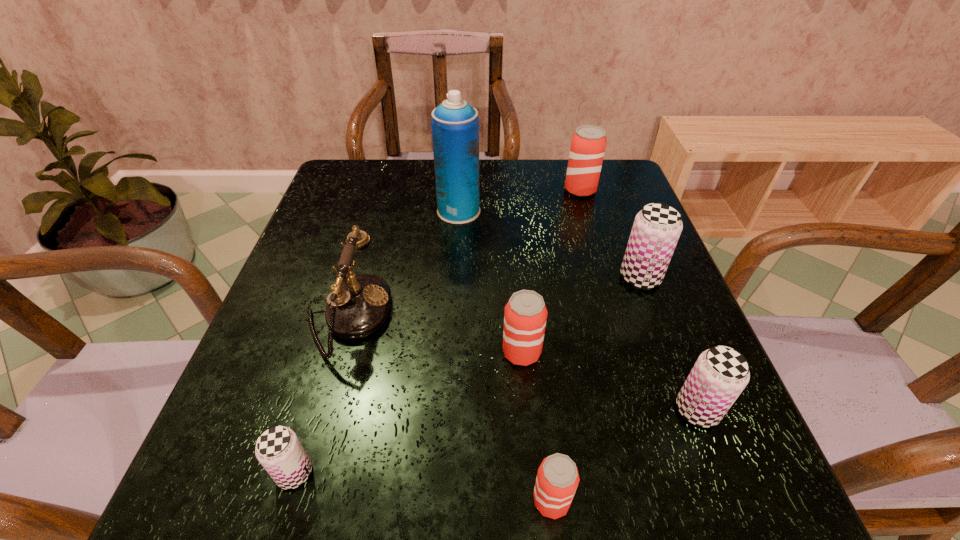
This screenshot has width=960, height=540. What are the coordinates of `vacant region located 0.060m on the back of the smallest purple beer can` in the screenshot? It's located at (311, 418).

Locate an element on the screen. vacant area located on the left of the smallest orange beer can is located at coordinates (419, 501).

This screenshot has height=540, width=960. I want to click on aerosol can at the far edge, so click(455, 123).

Where is `beer can positioned at the far edge`? The width and height of the screenshot is (960, 540). beer can positioned at the far edge is located at coordinates (588, 143).

Locate an element on the screen. This screenshot has height=540, width=960. telephone that is positioned at the left edge is located at coordinates (358, 305).

What are the coordinates of `beer can located in the left edge section of the desktop` in the screenshot? It's located at (278, 449).

Find the location of a particular element. The height and width of the screenshot is (540, 960). object that is at the near left corner is located at coordinates (278, 449).

This screenshot has width=960, height=540. Find the location of `object that is at the far right corner`. object that is at the far right corner is located at coordinates (588, 143).

In the image, there is a desktop. Identify the location of free region at the far edge. (540, 198).

Where is `vacant position at the near edge of the desktop`? The height and width of the screenshot is (540, 960). vacant position at the near edge of the desktop is located at coordinates (477, 515).